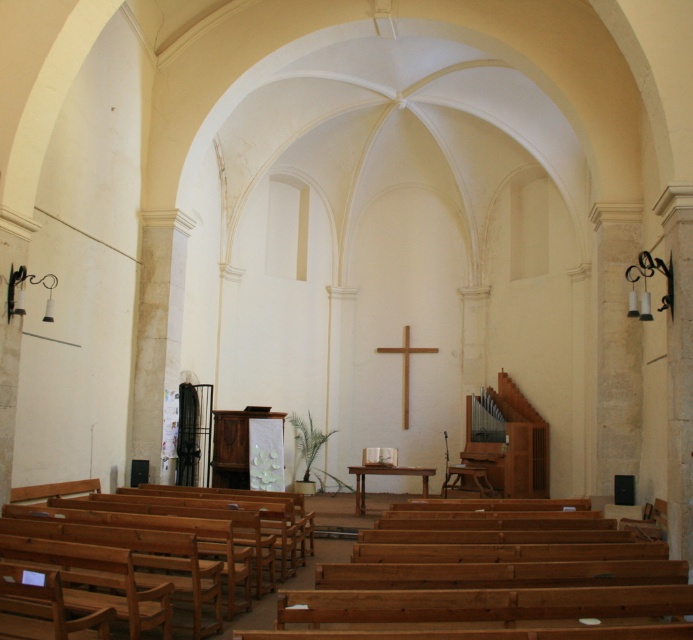
You are attending a church service and need to sit down. You see the natural wood church bench at lower left and the wooden polished table at center. Which object is positioned to the left of the other?

The natural wood church bench at lower left is to the left of the wooden polished table at center.

In the scene shown: You are standing at the entrance of the church and want to sit down. Where is the natural wood church bench at lower left located in the image?

The natural wood church bench at lower left is located at point [179,515] in the image.